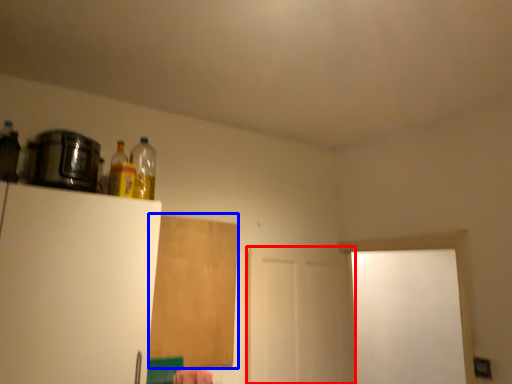
Question: Which of the following is the farthest to the observer, screen door (highlighted by a red box) or plywood (highlighted by a blue box)?

Choices:
 (A) screen door
 (B) plywood

Answer: (A)